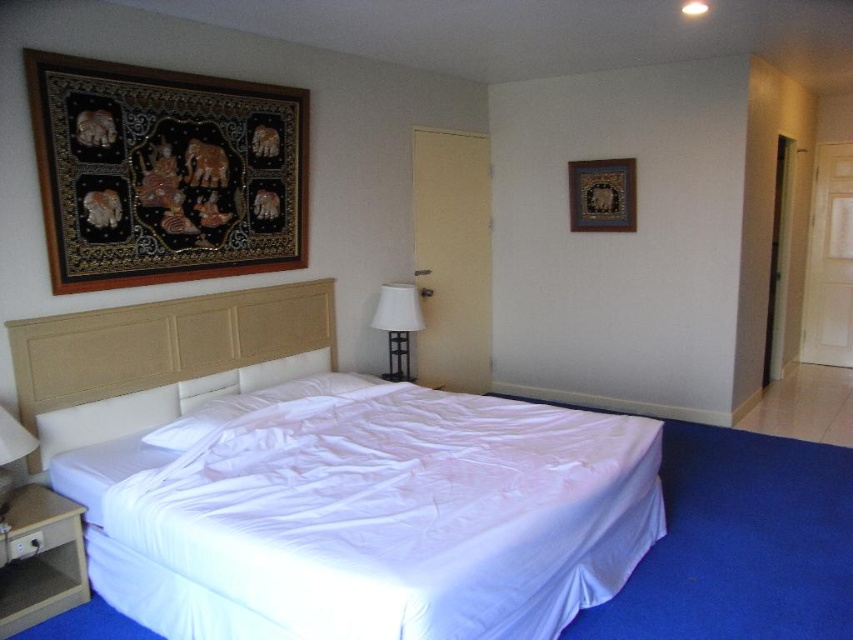
Is point (294, 291) farther from viewer compared to point (314, 385)?

Yes, point (294, 291) is farther from viewer.

Who is positioned more to the left, beige fabric headboard at left or white soft pillow at center?

beige fabric headboard at left

Based on the photo, who is more distant from viewer, (335,346) or (207,401)?

Positioned behind is point (335,346).

At what (x,y) coordinates should I click in order to perform the action: click on beige fabric headboard at left. Please return your answer as a coordinate pair (x, y). Looking at the image, I should click on (163, 342).

Locate an element on the screen. This screenshot has width=853, height=640. white fabric bed at center is located at coordinates (366, 515).

Where is `white fabric bed at center`? white fabric bed at center is located at coordinates (366, 515).

The image size is (853, 640). In order to click on white fabric bed at center in this screenshot , I will do `click(366, 515)`.

Who is more forward, (107, 250) or (585, 177)?

Point (107, 250)

Does black fabric tapestry at upper left come in front of gold textured picture frame at upper center?

Yes, black fabric tapestry at upper left is in front of gold textured picture frame at upper center.

Is point (229, 221) positioned behind point (635, 216)?

No, it is in front of (635, 216).

Where is `black fabric tapestry at upper left`? The height and width of the screenshot is (640, 853). black fabric tapestry at upper left is located at coordinates (164, 172).